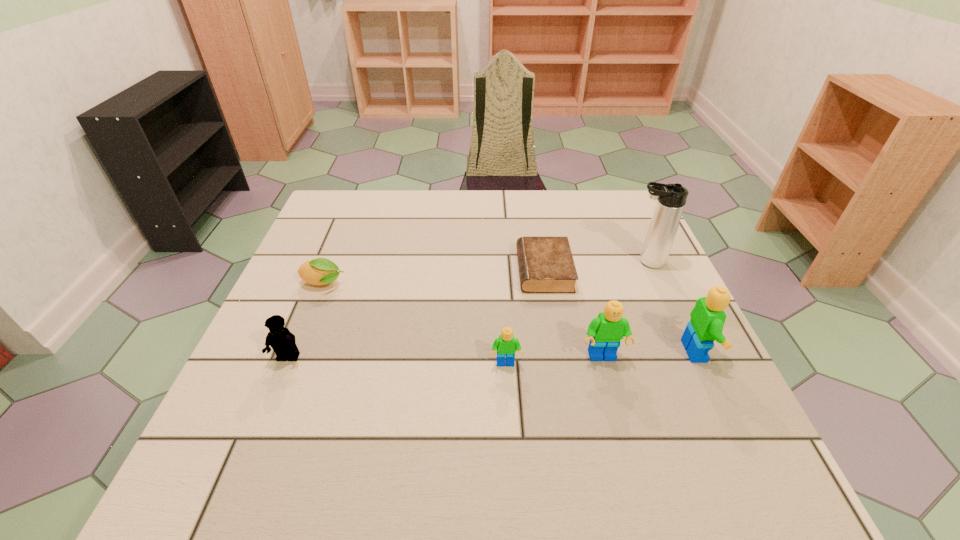
I want to click on vacant space that satisfies the following two spatial constraints: 1. on the handle side of the thermos bottle; 2. on the front-facing side of the leftmost Lego, so click(689, 357).

This screenshot has height=540, width=960. I want to click on blank area in the image that satisfies the following two spatial constraints: 1. on the handle side of the tallest object; 2. on the front-facing side of the leftmost Lego, so click(x=689, y=357).

This screenshot has width=960, height=540. Find the location of `vacant space that satisfies the following two spatial constraints: 1. on the handle side of the thermos bottle; 2. on the face of the third object from left to right`. vacant space that satisfies the following two spatial constraints: 1. on the handle side of the thermos bottle; 2. on the face of the third object from left to right is located at coordinates (692, 364).